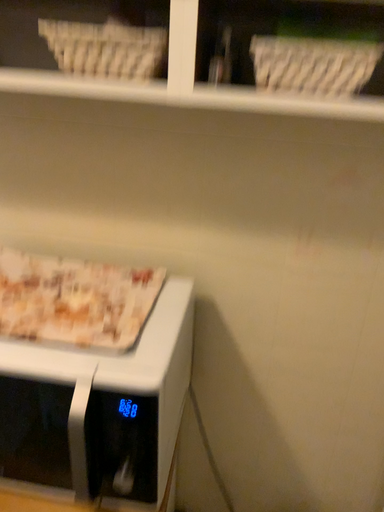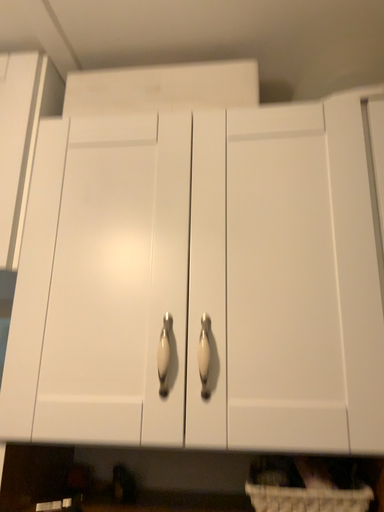
Question: How did the camera likely rotate when shooting the video?

Choices:
 (A) rotated upward
 (B) rotated downward

Answer: (A)